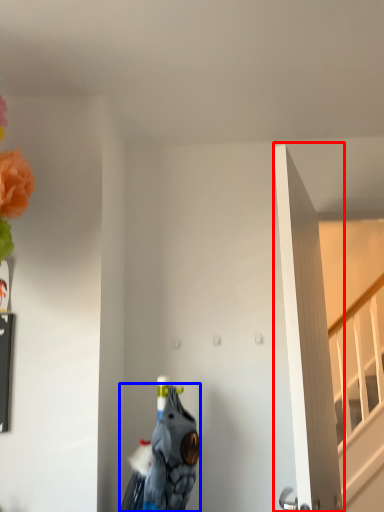
Question: Which of the following is the farthest to the observer, door (highlighted by a red box) or animal (highlighted by a blue box)?

Choices:
 (A) door
 (B) animal

Answer: (B)